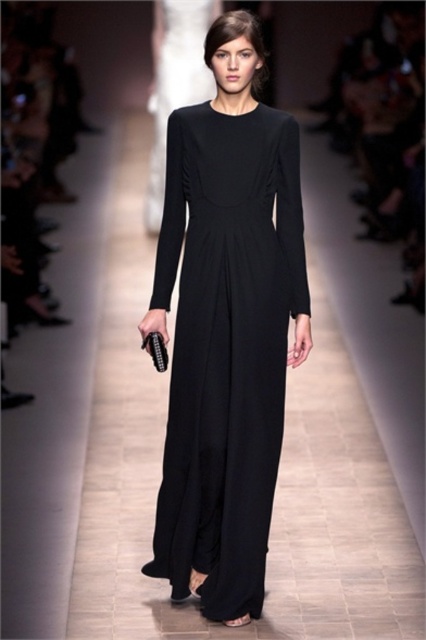
Between black matte dress at center and matte black dress at center, which one appears on the left side from the viewer's perspective?

From the viewer's perspective, matte black dress at center appears more on the left side.

Is black matte dress at center closer to camera compared to matte black dress at center?

Yes, black matte dress at center is in front of matte black dress at center.

Between point (239, 540) and point (157, 3), which one is positioned in front?

Point (239, 540) is more forward.

At what (x,y) coordinates should I click in order to perform the action: click on black matte dress at center. Please return your answer as a coordinate pair (x, y). The width and height of the screenshot is (426, 640). Looking at the image, I should click on (226, 346).